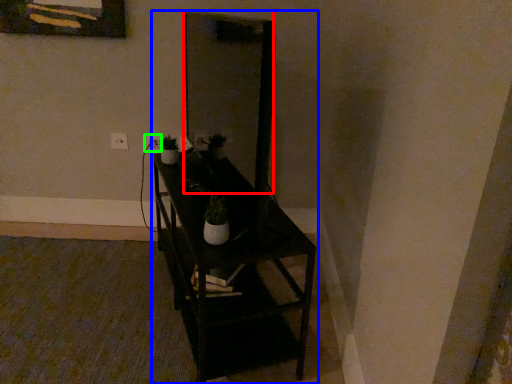
Question: Estimate the real-world distances between objects in this image. Which object is farther from mirror (highlighted by a red box), furniture (highlighted by a blue box) or electric outlet (highlighted by a green box)?

Choices:
 (A) furniture
 (B) electric outlet

Answer: (A)